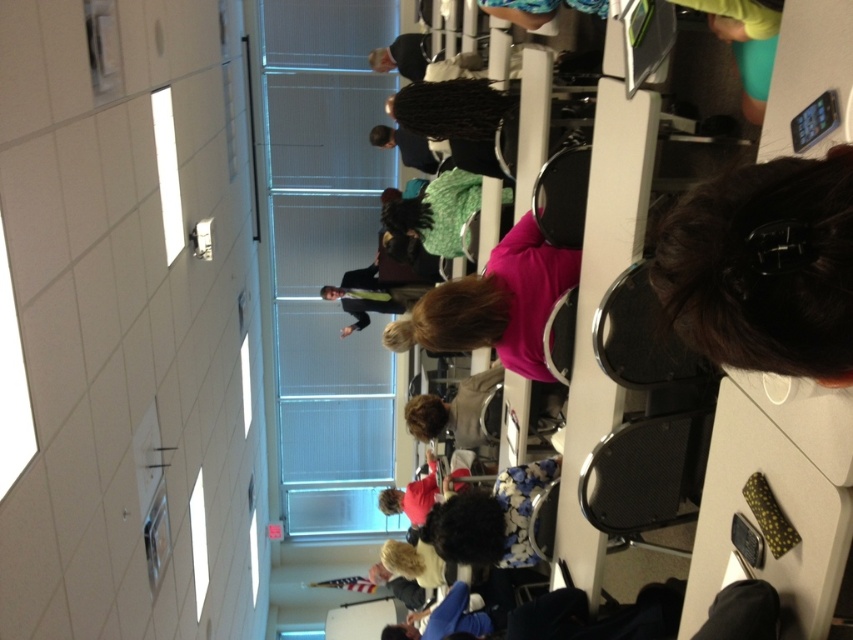
Can you confirm if dark brown hair at upper right is bigger than pink matte shirt at center?

Incorrect, dark brown hair at upper right is not larger than pink matte shirt at center.

Is dark brown hair at upper right wider than pink matte shirt at center?

No, dark brown hair at upper right is not wider than pink matte shirt at center.

Locate an element on the screen. Image resolution: width=853 pixels, height=640 pixels. dark brown hair at upper right is located at coordinates (764, 268).